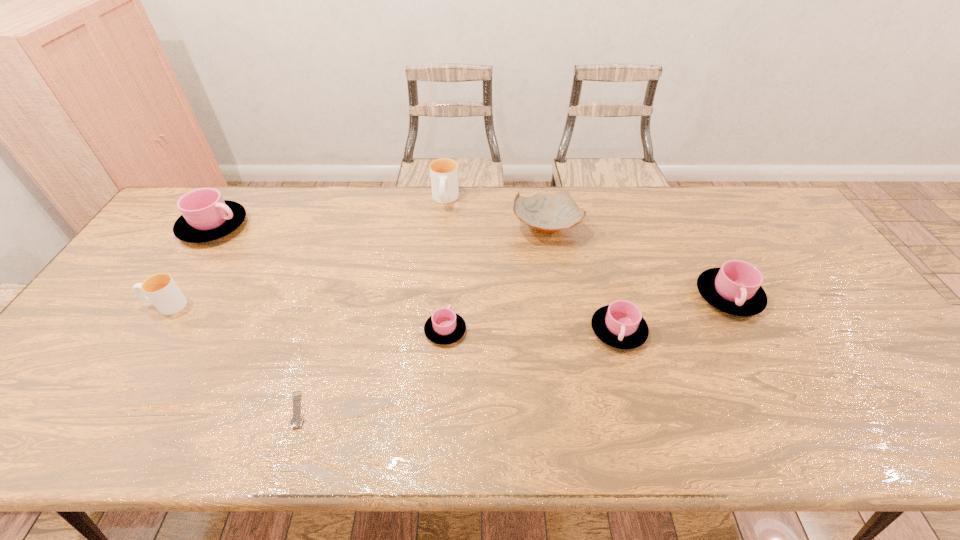
At what (x,y) coordinates should I click in order to perform the action: click on free space at the far edge of the desktop. Please return your answer as a coordinate pair (x, y). The image size is (960, 540). Looking at the image, I should click on (255, 213).

The image size is (960, 540). In order to click on free space at the near edge of the desktop in this screenshot , I will do `click(829, 416)`.

The width and height of the screenshot is (960, 540). What are the coordinates of `vacant region at the left edge of the desktop` in the screenshot? It's located at (158, 268).

Locate an element on the screen. The width and height of the screenshot is (960, 540). vacant space that's between the second smallest pink cup and the farthest pink cup is located at coordinates (416, 279).

You are a GUI agent. You are given a task and a screenshot of the screen. Output one action in this format:
    pyautogui.click(x=<x>, y=<y>)
    Task: Click on the free space between the second biggest pink cup and the right yellow cup
    Image resolution: width=960 pixels, height=540 pixels.
    Given the screenshot: What is the action you would take?
    pyautogui.click(x=587, y=248)

You are a GUI agent. You are given a task and a screenshot of the screen. Output one action in this format:
    pyautogui.click(x=<x>, y=<y>)
    Task: Click on the free space between the pottery and the smaller yellow cup
    
    Given the screenshot: What is the action you would take?
    pyautogui.click(x=356, y=266)

This screenshot has width=960, height=540. Find the location of `vacant space that is in between the watch and the pottery`. vacant space that is in between the watch and the pottery is located at coordinates (421, 319).

The image size is (960, 540). I want to click on vacant point located between the leftmost pink cup and the seventh tallest object, so click(329, 279).

You are a GUI agent. You are given a task and a screenshot of the screen. Output one action in this format:
    pyautogui.click(x=<x>, y=<y>)
    Task: Click on the free space between the biggest pink cup and the left yellow cup
    Image resolution: width=960 pixels, height=540 pixels.
    Given the screenshot: What is the action you would take?
    pyautogui.click(x=190, y=266)

The width and height of the screenshot is (960, 540). Find the location of `empty location between the farthest pink cup and the third object from left to right`. empty location between the farthest pink cup and the third object from left to right is located at coordinates (255, 318).